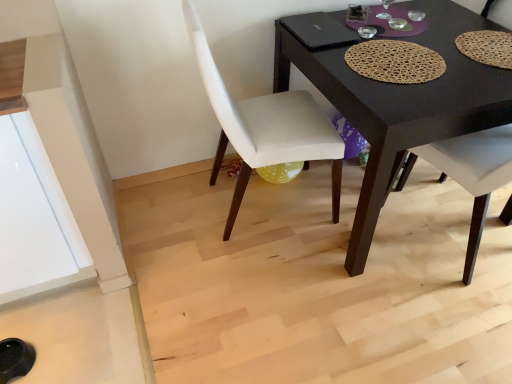
What is the approximate height of black matte desk at center?

black matte desk at center is 30.97 inches tall.

In order to click on black matte desk at center in this screenshot , I will do `click(402, 104)`.

Measure the distance between point (488, 130) and camera.

Point (488, 130) is 1.67 meters from camera.

The image size is (512, 384). In order to click on white fabric chair at center, arranged as the 1th chair when viewed from the left in this screenshot , I will do `click(265, 126)`.

Would you say white fabric chair at center, the second chair viewed from the right, is to the left or to the right of brown woven placemat at center in the picture?

white fabric chair at center, the second chair viewed from the right, is positioned on brown woven placemat at center's left side.

From a real-world perspective, between white fabric chair at center, arranged as the 1th chair when viewed from the left, and brown woven placemat at center, who is vertically higher?

brown woven placemat at center is physically above.

Can you tell me how much white fabric chair at center, the second chair viewed from the right, and brown woven placemat at center differ in facing direction?

85.4 degrees.

Identify the location of mat that appears above the white fabric chair at center, arranged as the 1th chair when viewed from the left (from a real-world perspective). This screenshot has height=384, width=512. (395, 62).

Can you tell me how much brown woven placemat at center and white fabric chair at center, arranged as the 1th chair when viewed from the left, differ in facing direction?

The angle between the facing direction of brown woven placemat at center and the facing direction of white fabric chair at center, arranged as the 1th chair when viewed from the left, is 85.4 degrees.

Would you say brown woven placemat at center is outside white fabric chair at center, arranged as the 1th chair when viewed from the left?

Absolutely, brown woven placemat at center is external to white fabric chair at center, arranged as the 1th chair when viewed from the left.

Between point (408, 60) and point (337, 166), which one is positioned in front?

The point (408, 60) is closer to the camera.

From the picture: Who is shorter, brown woven placemat at center or white fabric chair at center, arranged as the 1th chair when viewed from the left?

brown woven placemat at center.

From the picture: How different are the orientations of black matte desk at center and brown woven placemat at center in degrees?

There is a 2.2-degree angle between the facing directions of black matte desk at center and brown woven placemat at center.

Based on the photo, is black matte desk at center in contact with brown woven placemat at center?

They are not placed beside each other.

The width and height of the screenshot is (512, 384). Find the location of `desk located below the brown woven placemat at center (from the image's perspective)`. desk located below the brown woven placemat at center (from the image's perspective) is located at coordinates (402, 104).

Is point (455, 29) closer or farther from the camera than point (405, 83)?

Point (455, 29) is farther from the camera than point (405, 83).

How distant is brown woven placemat at center from matte woven placemat at upper right, the second chair in the left-to-right sequence?

The distance of brown woven placemat at center from matte woven placemat at upper right, the second chair in the left-to-right sequence, is 14.79 inches.

Considering the sizes of brown woven placemat at center and matte woven placemat at upper right, which is counted as the first chair, starting from the right, in the image, is brown woven placemat at center taller or shorter than matte woven placemat at upper right, which is counted as the first chair, starting from the right,?

brown woven placemat at center is shorter than matte woven placemat at upper right, which is counted as the first chair, starting from the right.

Considering their positions, is brown woven placemat at center located in front of or behind matte woven placemat at upper right, which is counted as the first chair, starting from the right?

Clearly, brown woven placemat at center is in front of matte woven placemat at upper right, which is counted as the first chair, starting from the right.

From a real-world perspective, which is physically above, white fabric chair at center, arranged as the 1th chair when viewed from the left, or matte woven placemat at upper right, the second chair in the left-to-right sequence?

white fabric chair at center, arranged as the 1th chair when viewed from the left.

Where is `chair located behind the white fabric chair at center, the second chair viewed from the right`? The height and width of the screenshot is (384, 512). chair located behind the white fabric chair at center, the second chair viewed from the right is located at coordinates click(475, 159).

Which object is thinner, white fabric chair at center, arranged as the 1th chair when viewed from the left, or matte woven placemat at upper right, which is counted as the first chair, starting from the right?

Thinner between the two is white fabric chair at center, arranged as the 1th chair when viewed from the left.

From a real-world perspective, is matte woven placemat at upper right, the second chair in the left-to-right sequence, located beneath white fabric chair at center, the second chair viewed from the right?

Yes, from a real-world perspective, matte woven placemat at upper right, the second chair in the left-to-right sequence, is below white fabric chair at center, the second chair viewed from the right.

Which object is further away from the camera taking this photo, matte woven placemat at upper right, the second chair in the left-to-right sequence, or white fabric chair at center, the second chair viewed from the right?

Positioned behind is matte woven placemat at upper right, the second chair in the left-to-right sequence.

Does point (471, 190) lie in front of point (213, 69)?

No, (471, 190) is behind (213, 69).

Does matte woven placemat at upper right, the second chair in the left-to-right sequence, have a greater width compared to white fabric chair at center, arranged as the 1th chair when viewed from the left?

Yes, matte woven placemat at upper right, the second chair in the left-to-right sequence, is wider than white fabric chair at center, arranged as the 1th chair when viewed from the left.

Does point (320, 126) come closer to viewer compared to point (415, 139)?

No, (320, 126) is further to viewer.

Are white fabric chair at center, arranged as the 1th chair when viewed from the left, and black matte desk at center located far from each other?

No.

The image size is (512, 384). Find the location of `desk on the right of white fabric chair at center, the second chair viewed from the right`. desk on the right of white fabric chair at center, the second chair viewed from the right is located at coordinates [402, 104].

Is white fabric chair at center, arranged as the 1th chair when viewed from the left, at the right side of black matte desk at center?

Incorrect, white fabric chair at center, arranged as the 1th chair when viewed from the left, is not on the right side of black matte desk at center.

Locate an element on the screen. mat above the white fabric chair at center, arranged as the 1th chair when viewed from the left (from the image's perspective) is located at coordinates tap(395, 62).

Where is `chair below the brown woven placemat at center (from the image's perspective)`? Image resolution: width=512 pixels, height=384 pixels. chair below the brown woven placemat at center (from the image's perspective) is located at coordinates (265, 126).

When comparing their distances from white fabric chair at center, arranged as the 1th chair when viewed from the left, does black matte desk at center or matte woven placemat at upper right, which is counted as the first chair, starting from the right, seem closer?

The object closer to white fabric chair at center, arranged as the 1th chair when viewed from the left, is black matte desk at center.

Looking at the image, which one is located further to matte woven placemat at upper right, the second chair in the left-to-right sequence, white fabric chair at center, arranged as the 1th chair when viewed from the left, or black matte desk at center?

white fabric chair at center, arranged as the 1th chair when viewed from the left, lies further to matte woven placemat at upper right, the second chair in the left-to-right sequence, than the other object.

Estimate the real-world distances between objects in this image. Which object is further from matte woven placemat at upper right, which is counted as the first chair, starting from the right, white fabric chair at center, the second chair viewed from the right, or brown woven placemat at center?

white fabric chair at center, the second chair viewed from the right, lies further to matte woven placemat at upper right, which is counted as the first chair, starting from the right, than the other object.

When comparing their distances from brown woven placemat at center, does matte woven placemat at upper right, the second chair in the left-to-right sequence, or black matte desk at center seem closer?

The object closer to brown woven placemat at center is black matte desk at center.

Based on their spatial positions, is black matte desk at center or white fabric chair at center, the second chair viewed from the right, closer to matte woven placemat at upper right, the second chair in the left-to-right sequence?

Based on the image, black matte desk at center appears to be nearer to matte woven placemat at upper right, the second chair in the left-to-right sequence.

Estimate the real-world distances between objects in this image. Which object is further from brown woven placemat at center, black matte desk at center or matte woven placemat at upper right, which is counted as the first chair, starting from the right?

The object further to brown woven placemat at center is matte woven placemat at upper right, which is counted as the first chair, starting from the right.

Estimate the real-world distances between objects in this image. Which object is further from brown woven placemat at center, white fabric chair at center, arranged as the 1th chair when viewed from the left, or black matte desk at center?

white fabric chair at center, arranged as the 1th chair when viewed from the left, is further to brown woven placemat at center.

Which object lies nearer to the anchor point brown woven placemat at center, white fabric chair at center, the second chair viewed from the right, or matte woven placemat at upper right, which is counted as the first chair, starting from the right?

matte woven placemat at upper right, which is counted as the first chair, starting from the right.

The height and width of the screenshot is (384, 512). I want to click on mat situated between white fabric chair at center, arranged as the 1th chair when viewed from the left, and matte woven placemat at upper right, which is counted as the first chair, starting from the right, from left to right, so click(x=395, y=62).

Find the location of a particular element. This screenshot has height=384, width=512. mat between white fabric chair at center, arranged as the 1th chair when viewed from the left, and black matte desk at center from left to right is located at coordinates (395, 62).

Where is `desk between white fabric chair at center, arranged as the 1th chair when viewed from the left, and matte woven placemat at upper right, the second chair in the left-to-right sequence, from left to right`? This screenshot has height=384, width=512. desk between white fabric chair at center, arranged as the 1th chair when viewed from the left, and matte woven placemat at upper right, the second chair in the left-to-right sequence, from left to right is located at coordinates tap(402, 104).

Identify the location of desk located between brown woven placemat at center and matte woven placemat at upper right, which is counted as the first chair, starting from the right, in the left-right direction. (402, 104).